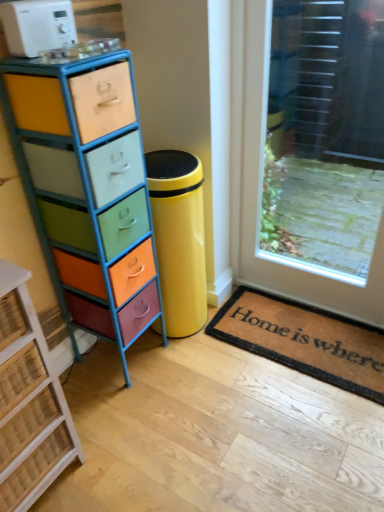
Question: Is multicolored painted wood chest of drawers at left, which is the 1th chest of drawers from right to left, positioned with its back to white plastic microwave at upper left?

Choices:
 (A) no
 (B) yes

Answer: (A)

Question: Is the surface of multicolored painted wood chest of drawers at left, which is the 1th chest of drawers from right to left, in direct contact with white plastic microwave at upper left?

Choices:
 (A) yes
 (B) no

Answer: (B)

Question: Does multicolored painted wood chest of drawers at left, which is the second chest of drawers in left-to-right order, have a larger size compared to white plastic microwave at upper left?

Choices:
 (A) no
 (B) yes

Answer: (B)

Question: Is white plastic microwave at upper left surrounded by multicolored painted wood chest of drawers at left, which is the second chest of drawers in left-to-right order?

Choices:
 (A) yes
 (B) no

Answer: (B)

Question: Could you tell me if multicolored painted wood chest of drawers at left, which is the second chest of drawers in left-to-right order, is turned towards white plastic microwave at upper left?

Choices:
 (A) no
 (B) yes

Answer: (A)

Question: From their relative heights in the image, would you say brown coir mat at lower right is taller or shorter than multicolored painted wood chest of drawers at left, which is the second chest of drawers in left-to-right order?

Choices:
 (A) short
 (B) tall

Answer: (A)

Question: Based on their sizes in the image, would you say brown coir mat at lower right is bigger or smaller than multicolored painted wood chest of drawers at left, which is the second chest of drawers in left-to-right order?

Choices:
 (A) big
 (B) small

Answer: (B)

Question: From a real-world perspective, is brown coir mat at lower right positioned above or below multicolored painted wood chest of drawers at left, which is the second chest of drawers in left-to-right order?

Choices:
 (A) below
 (B) above

Answer: (A)

Question: Looking at their shapes, would you say brown coir mat at lower right is wider or thinner than multicolored painted wood chest of drawers at left, which is the second chest of drawers in left-to-right order?

Choices:
 (A) wide
 (B) thin

Answer: (A)

Question: Would you say white plastic microwave at upper left is to the left or to the right of multicolored painted wood chest of drawers at left, which is the second chest of drawers in left-to-right order, in the picture?

Choices:
 (A) left
 (B) right

Answer: (A)

Question: Considering the positions of white plastic microwave at upper left and multicolored painted wood chest of drawers at left, which is the 1th chest of drawers from right to left, in the image, is white plastic microwave at upper left bigger or smaller than multicolored painted wood chest of drawers at left, which is the 1th chest of drawers from right to left,?

Choices:
 (A) big
 (B) small

Answer: (B)

Question: Does point (13, 5) appear closer or farther from the camera than point (117, 249)?

Choices:
 (A) closer
 (B) farther

Answer: (A)

Question: Relative to multicolored painted wood chest of drawers at left, which is the second chest of drawers in left-to-right order, is white plastic microwave at upper left in front or behind?

Choices:
 (A) front
 (B) behind

Answer: (B)

Question: From a real-world perspective, is transparent glass door at upper right positioned above or below rustic wicker chest of drawers at left, which is the 1th chest of drawers in left-to-right order?

Choices:
 (A) above
 (B) below

Answer: (A)

Question: Considering the relative positions of transparent glass door at upper right and rustic wicker chest of drawers at left, which is the 1th chest of drawers in left-to-right order, in the image provided, is transparent glass door at upper right to the left or to the right of rustic wicker chest of drawers at left, which is the 1th chest of drawers in left-to-right order,?

Choices:
 (A) right
 (B) left

Answer: (A)